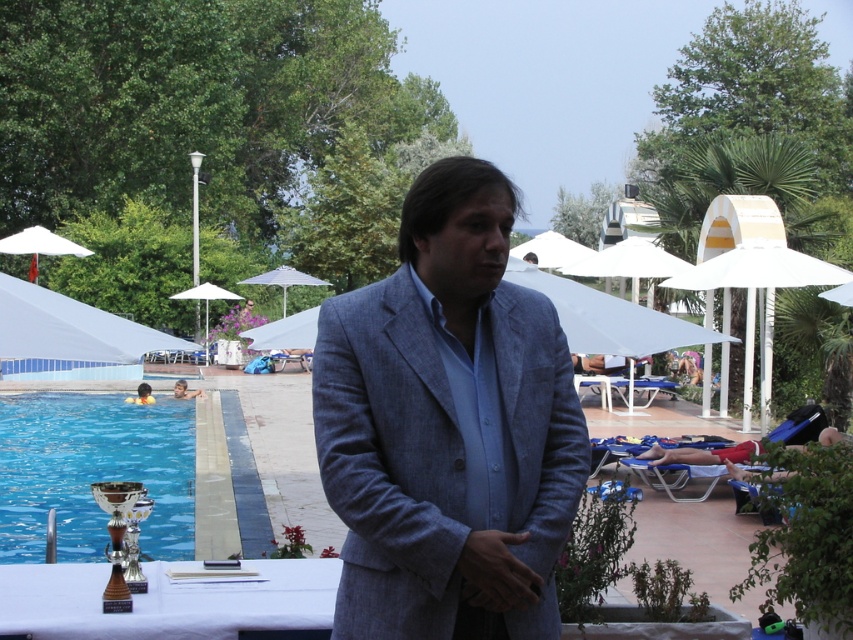
Question: Among these objects, which one is nearest to the camera?

Choices:
 (A) matte gray suit at center
 (B) light blue textured suit at center
 (C) white fabric umbrella at upper left
 (D) matte blue shirt at center

Answer: (B)

Question: Is blue glass trophy at lower left below white fabric umbrella at upper center?

Choices:
 (A) no
 (B) yes

Answer: (B)

Question: Which point is farther from the camera taking this photo?

Choices:
 (A) (527, 259)
 (B) (320, 364)

Answer: (A)

Question: Does smooth skin boy at lower left appear on the left side of matte blue shirt at center?

Choices:
 (A) yes
 (B) no

Answer: (B)

Question: Can you confirm if white fabric umbrella at upper center is smaller than matte blue shirt at center?

Choices:
 (A) yes
 (B) no

Answer: (B)

Question: Which of these objects is positioned closest to the smooth skin boy at lower left?

Choices:
 (A) light blue textured suit at center
 (B) matte blue shirt at center

Answer: (B)